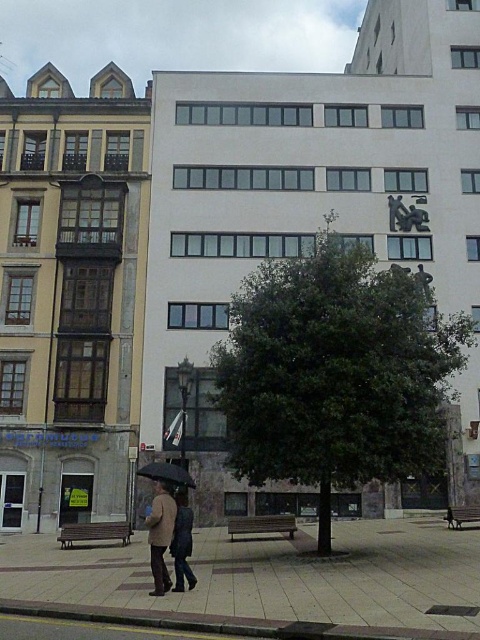
You are a pedestrian standing in the middle of the urban scene. You see a green leafy tree at center and a brown leather jacket at center. Which object is closer to your right side?

The green leafy tree at center is positioned on the right side of brown leather jacket at center, so it is closer to your right side.

You are a delivery person who needs to place a large package on the ground. You see the brown leather jacket at center and the black matte umbrella at lower center. Which object can you place the package next to without it being obstructed by either?

The brown leather jacket at center has a larger size compared to the black matte umbrella at lower center. Therefore, placing the package next to the black matte umbrella at lower center would leave more space and avoid obstruction from the larger jacket.